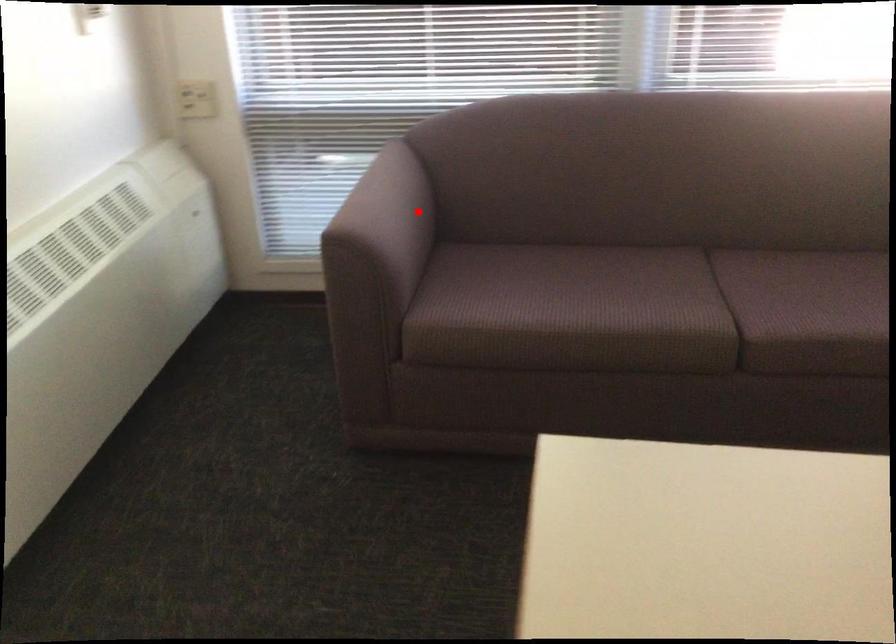
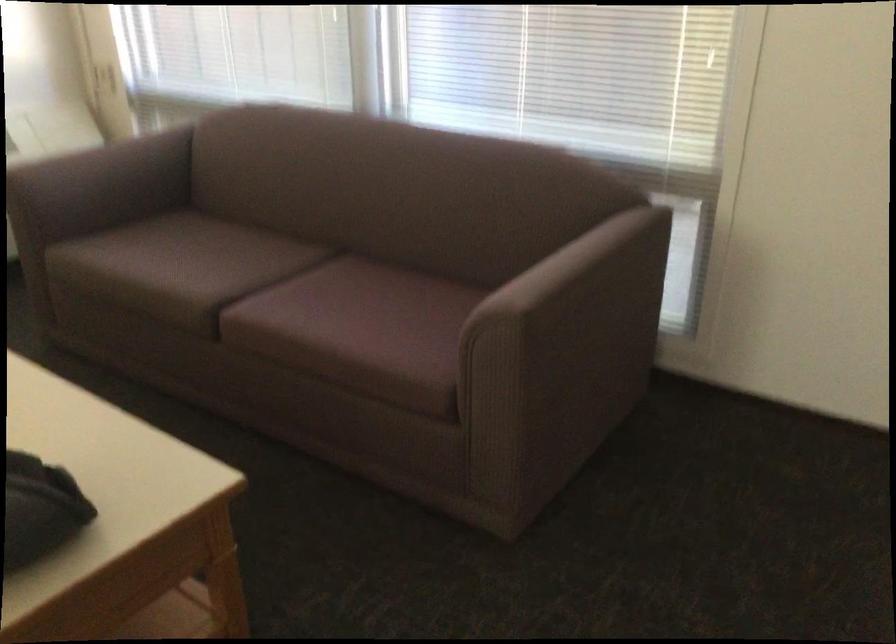
Question: I am providing you with two images of the same scene from different viewpoints. A red point is shown in image1. For the corresponding object point in image2, is it positioned nearer or farther from the camera?

Choices:
 (A) Nearer
 (B) Farther

Answer: (B)